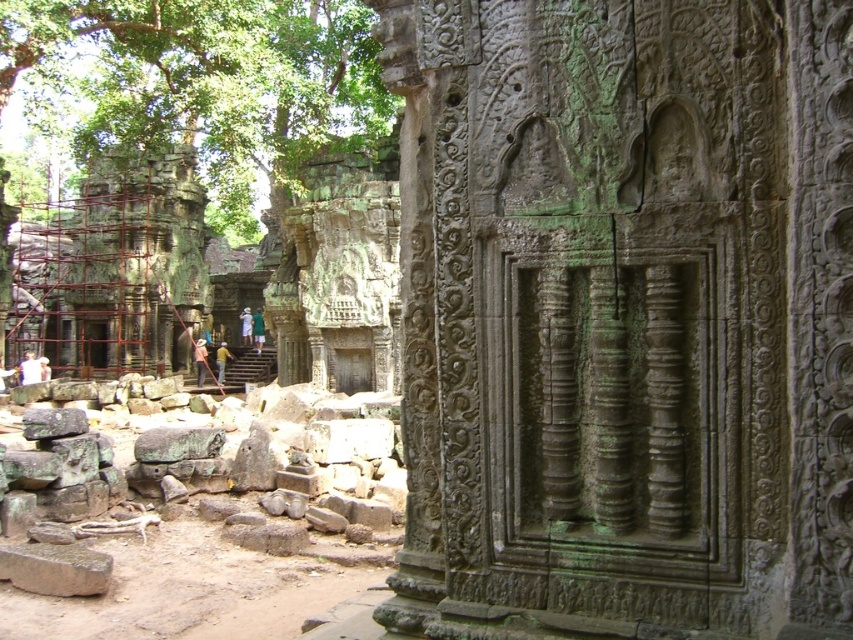
Question: Is green stone carving at center to the left of green mossy stone at upper left from the viewer's perspective?

Choices:
 (A) yes
 (B) no

Answer: (B)

Question: In this image, where is green stone carving at center located relative to green mossy stone at upper left?

Choices:
 (A) above
 (B) below

Answer: (B)

Question: Among these points, which one is nearest to the camera?

Choices:
 (A) (827, 237)
 (B) (207, 173)

Answer: (A)

Question: Is green stone carving at center positioned before green mossy stone at upper left?

Choices:
 (A) yes
 (B) no

Answer: (A)

Question: Which point appears closest to the camera in this image?

Choices:
 (A) (277, 144)
 (B) (734, 602)

Answer: (B)